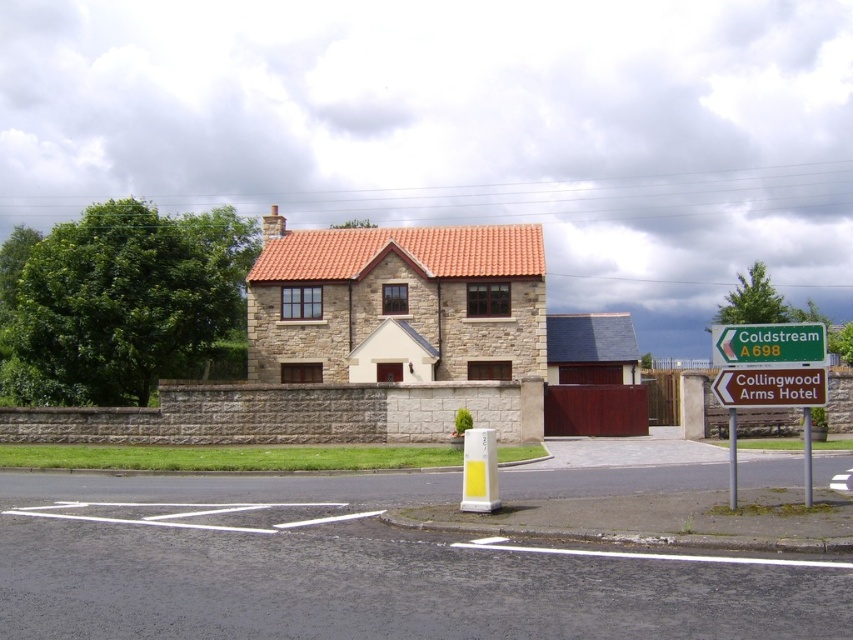
Does green plastic sign at upper right have a smaller size compared to greenmaterial/texturesign at upper right?

Incorrect, green plastic sign at upper right is not smaller in size than greenmaterial/texturesign at upper right.

Does green plastic sign at upper right have a greater height compared to greenmaterial/texturesign at upper right?

Indeed, green plastic sign at upper right has a greater height compared to greenmaterial/texturesign at upper right.

Find the location of `green plastic sign at upper right`. green plastic sign at upper right is located at coordinates (769, 342).

Find the location of a particular element. green plastic sign at upper right is located at coordinates (769, 342).